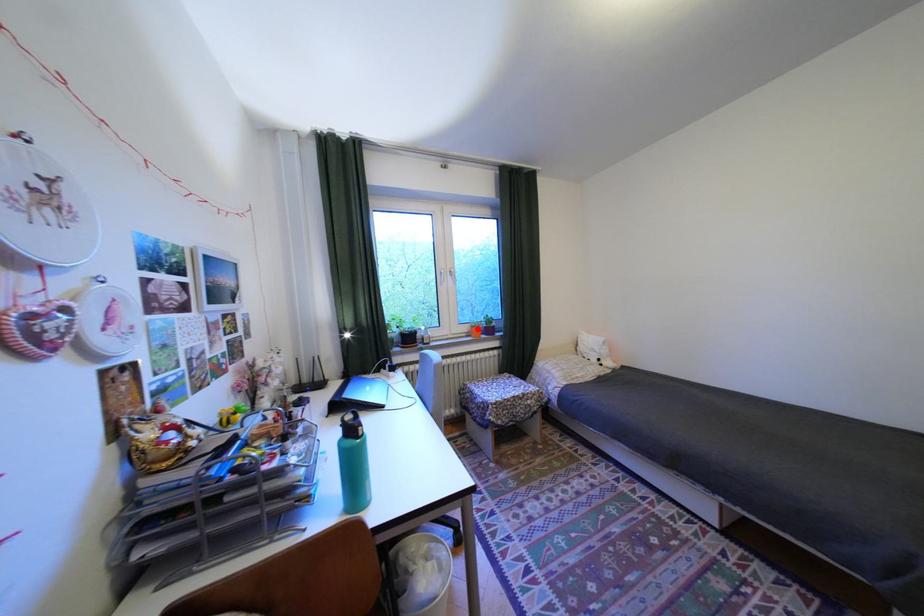
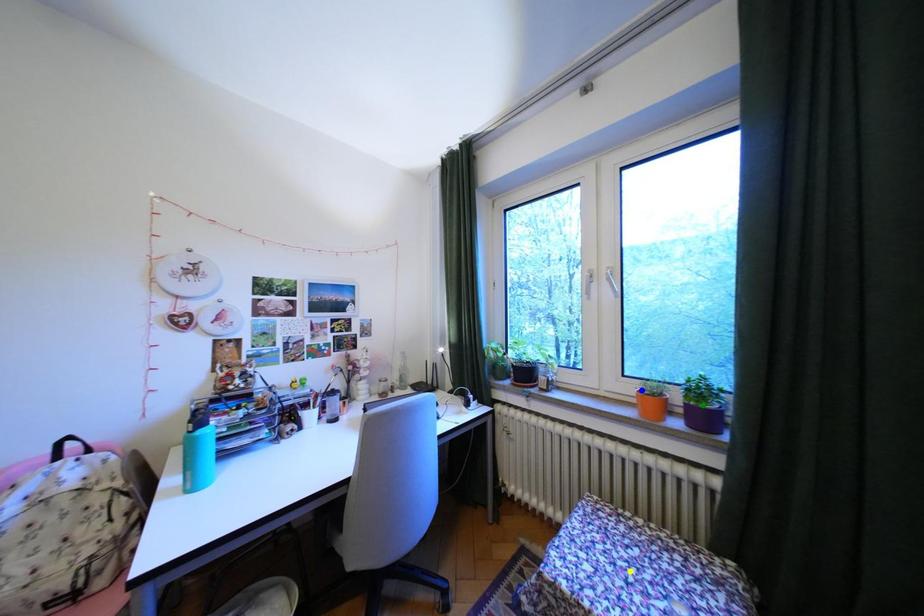
Question: I am providing you with two images of the same scene from different viewpoints. A red point is marked on the first image. You are given multiple points on the second image. Can you choose the point in image 2 that corresponds to the point in image 1?

Choices:
 (A) yellow point
 (B) blue point
 (C) green point

Answer: (B)